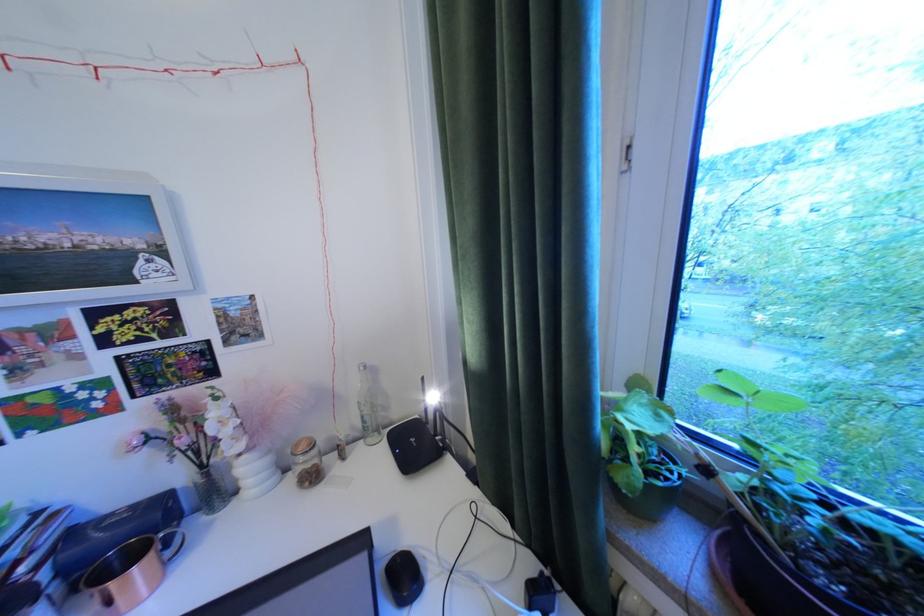
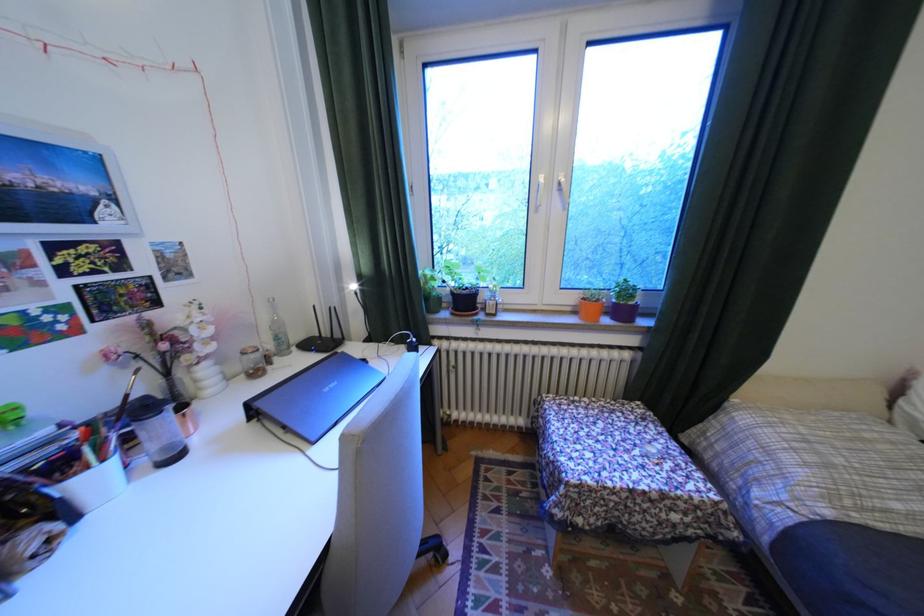
In the second image, find the point that corresponds to point 373,418 in the first image.

(287, 338)